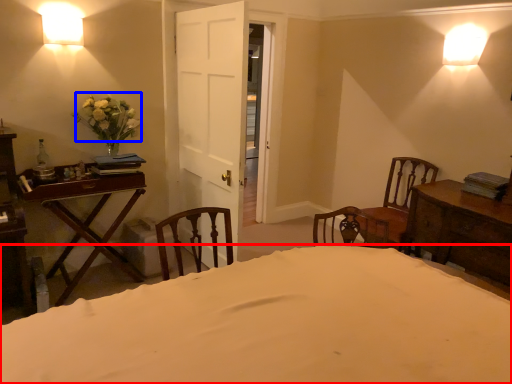
Question: Which object is further to the camera taking this photo, bed (highlighted by a red box) or flower (highlighted by a blue box)?

Choices:
 (A) bed
 (B) flower

Answer: (B)